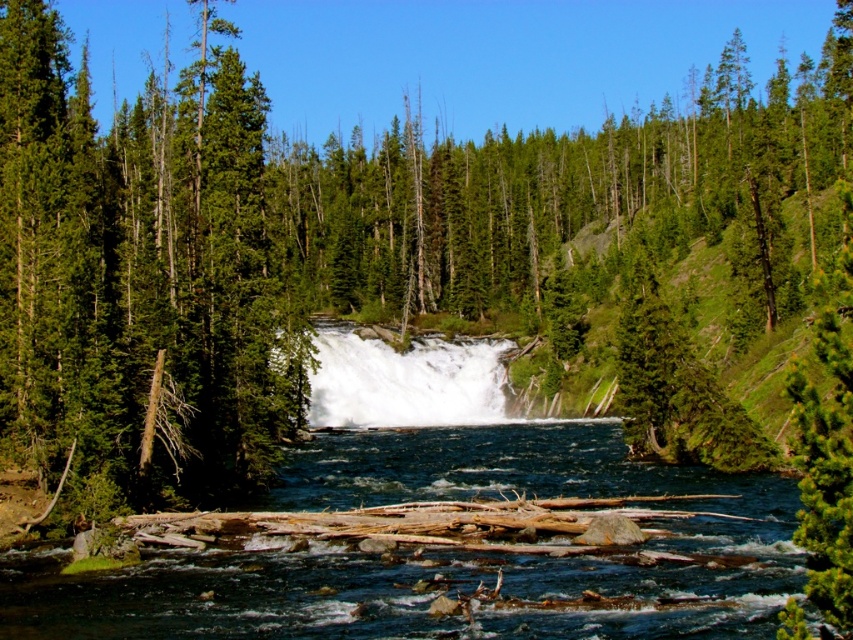
You are a hiker standing at the edge of the forest near the green matte tree at left and the white frothy water at center. You want to cross the river to the other side. Which object should you use as a reference point to determine the safest path? Explain your reasoning.

The green matte tree at left is wider than the white frothy water at center. Since the tree is wider, it can provide a stable reference point for navigating the turbulent river safely.

Consider the image. You are standing at the center of the image facing the waterfall. Which direction should you walk to reach the green matte tree at left?

The green matte tree at left is located at point (140, 275), so you should walk to the left to reach it.